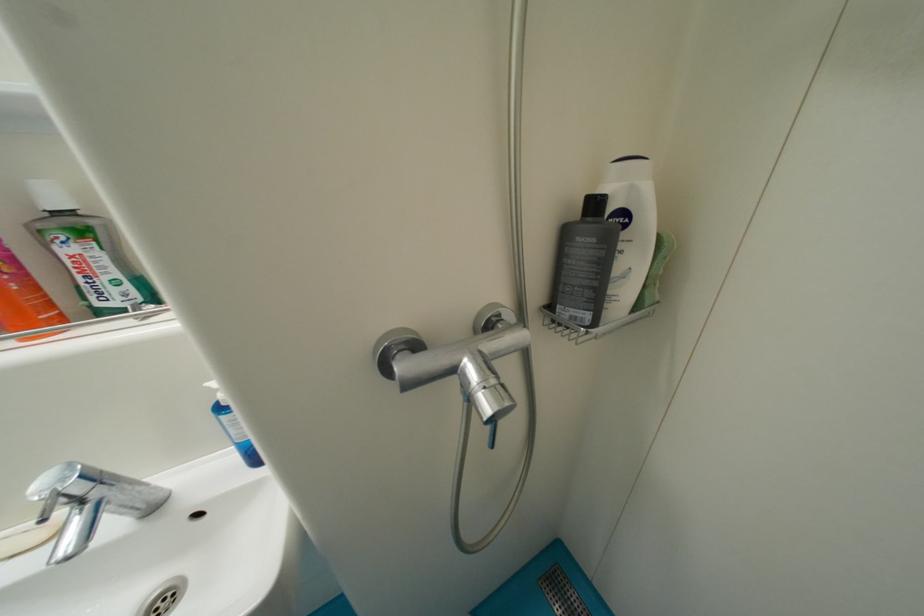
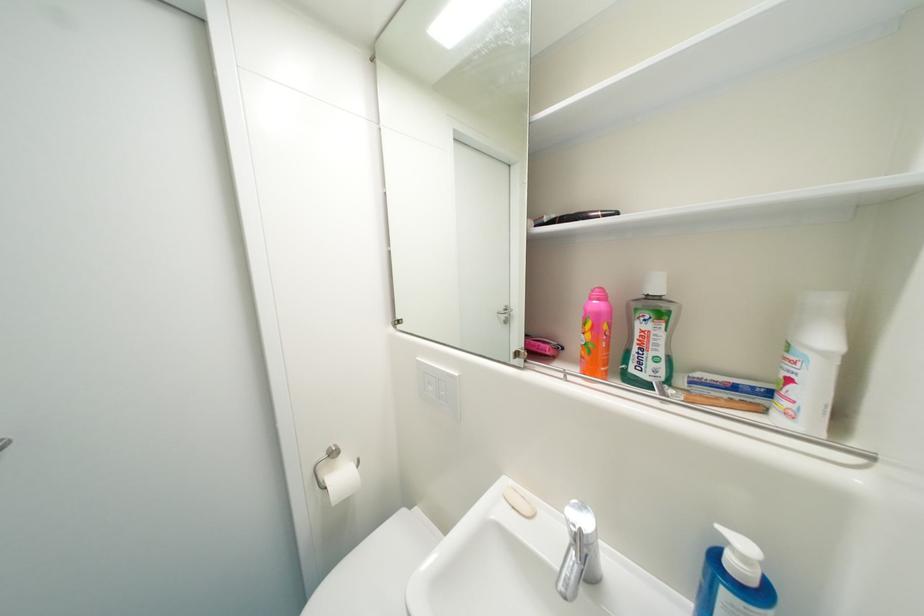
Question: The camera is either moving clockwise (left) or counter-clockwise (right) around the object. The first image is from the beginning of the video and the second image is from the end. Is the camera moving left or right when shooting the video?

Choices:
 (A) Left
 (B) Right

Answer: (B)